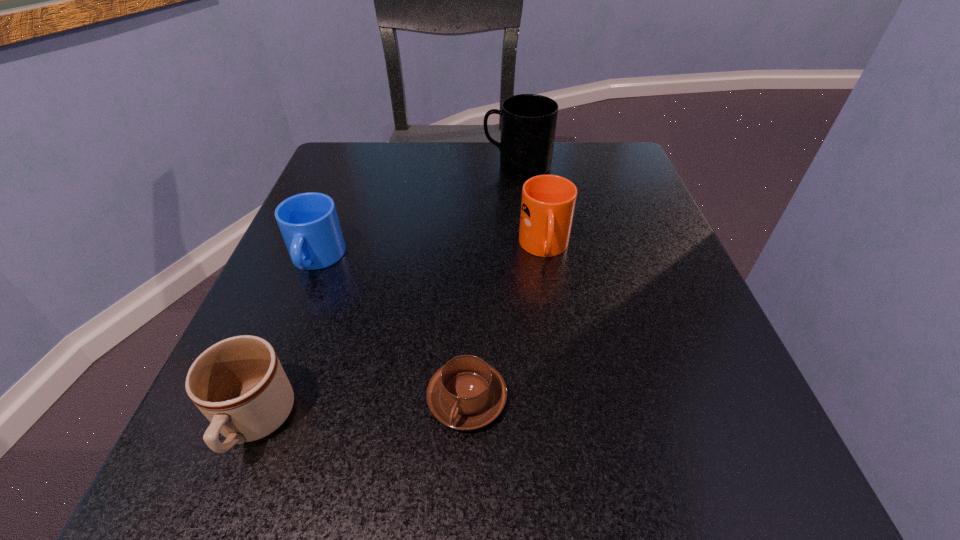
You are a GUI agent. You are given a task and a screenshot of the screen. Output one action in this format:
    pyautogui.click(x=<x>, y=<y>)
    Task: Click on the farthest mug
    This screenshot has width=960, height=540.
    Given the screenshot: What is the action you would take?
    pyautogui.click(x=528, y=121)

The width and height of the screenshot is (960, 540). I want to click on the tallest mug, so (528, 121).

At what (x,y) coordinates should I click in order to perform the action: click on the nearest mug. Please return your answer as a coordinate pair (x, y). The width and height of the screenshot is (960, 540). Looking at the image, I should click on tap(239, 385).

This screenshot has width=960, height=540. Find the location of `cappuccino`. cappuccino is located at coordinates (467, 393).

Where is `free region located on the side of the farthest mug with the handle`? The width and height of the screenshot is (960, 540). free region located on the side of the farthest mug with the handle is located at coordinates (340, 166).

Locate an element on the screen. free point located 0.120m on the side of the farthest mug with the handle is located at coordinates (429, 166).

This screenshot has width=960, height=540. Find the location of `vacant space situated 0.210m on the side of the farthest mug with the handle`. vacant space situated 0.210m on the side of the farthest mug with the handle is located at coordinates (389, 166).

You are a GUI agent. You are given a task and a screenshot of the screen. Output one action in this format:
    pyautogui.click(x=<x>, y=<y>)
    Task: Click on the vacant space located on the side of the shortest object with the handle
    This screenshot has width=960, height=540.
    Given the screenshot: What is the action you would take?
    pyautogui.click(x=465, y=497)

Where is `object that is at the far edge`? Image resolution: width=960 pixels, height=540 pixels. object that is at the far edge is located at coordinates (528, 121).

I want to click on object that is at the near edge, so click(x=239, y=385).